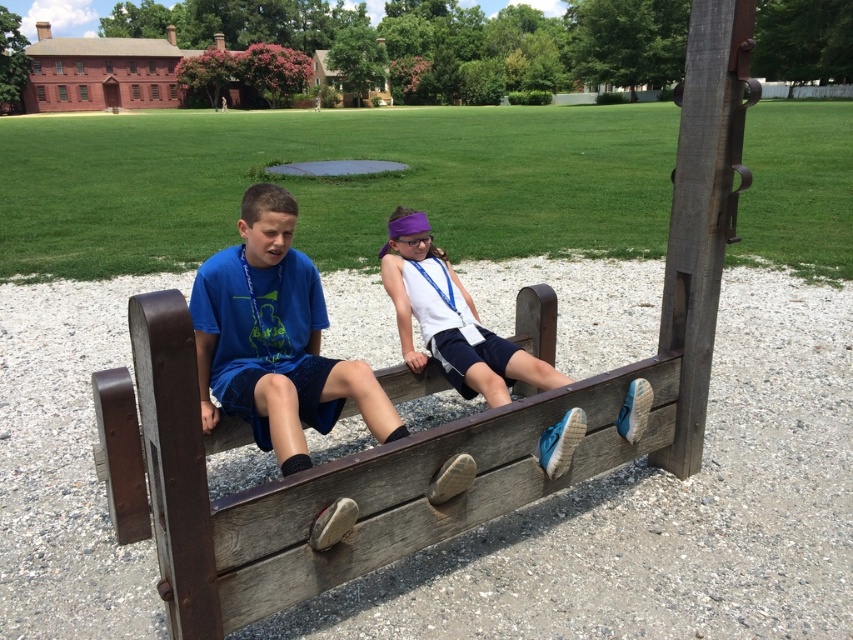
You are a photographer trying to capture a candid shot of the two children sitting on the bench. You want to ensure both are in focus. Given that your camera has a depth of field that can cover 30 inches, will you need to adjust your settings to include both the blue fabric shirt at center and the white matte tank top at center in the same frame?

The blue fabric shirt at center and the white matte tank top at center are 32.53 inches apart. Since the camera can only cover 30 inches, you will need to adjust your settings to ensure both are in focus.

You are a photographer trying to capture both the blue fabric shirt at center and the white matte tank top at center in a single shot. Since you want to ensure both are visible, which direction should you position your camera relative to the children?

You should position your camera to the right of the children so that both the blue fabric shirt at center and the white matte tank top at center are visible in the frame. Since the blue fabric shirt at center is to the left of the white matte tank top at center, facing the right side will ensure both are included.

You are a photographer trying to capture both children in a single frame. Given their positions and the bench, can you fit both the blue fabric shirt at center and the white matte tank top at center into the frame without moving either child?

The blue fabric shirt at center is wider than the white matte tank top at center. Since both are positioned at the center of the bench, their combined width may exceed the frame capacity. Adjust the camera angle or zoom to ensure both fit comfortably within the shot.